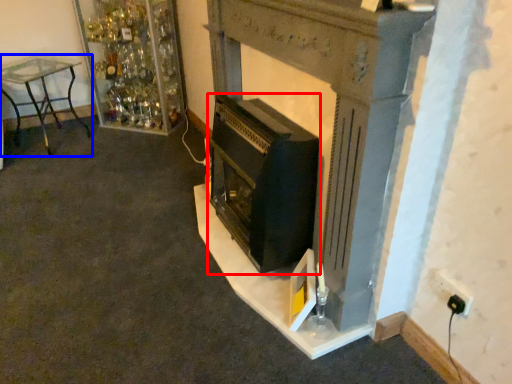
Question: Which object is further to the camera taking this photo, wood burning stove (highlighted by a red box) or furniture (highlighted by a blue box)?

Choices:
 (A) wood burning stove
 (B) furniture

Answer: (B)